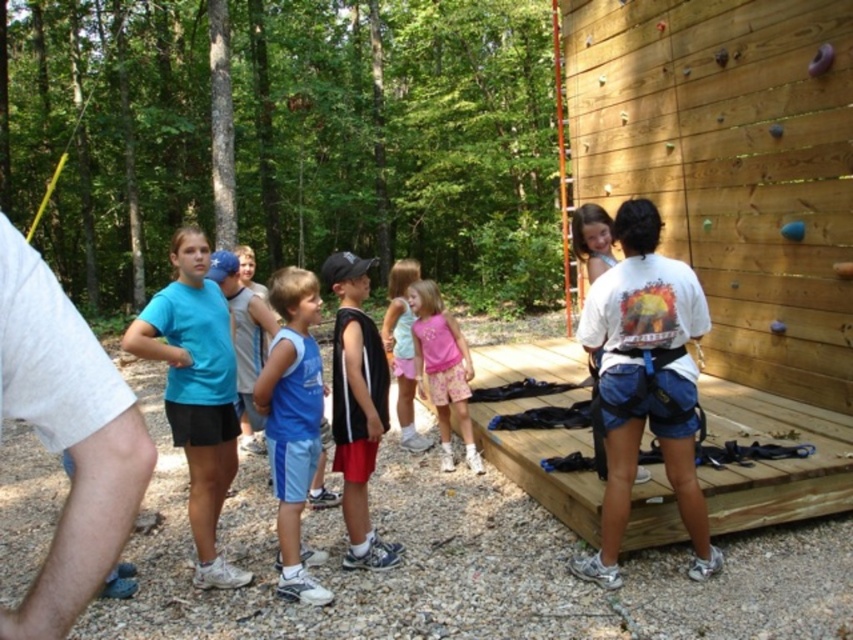
Question: Estimate the real-world distances between objects in this image. Which object is farther from the pink cotton shirt at center?

Choices:
 (A) matte blue t-shirt at center
 (B) blue fabric shorts at center
 (C) pink cotton dress at center
 (D) white cotton shirt at left

Answer: (D)

Question: Based on their relative distances, which object is nearer to the pink cotton dress at center?

Choices:
 (A) blue fabric shorts at center
 (B) pink cotton shirt at center

Answer: (B)

Question: Does matte blue t-shirt at center lie behind blue fabric shorts at center?

Choices:
 (A) no
 (B) yes

Answer: (A)

Question: From the image, what is the correct spatial relationship of white cotton shirt at left in relation to blue fabric shorts at center?

Choices:
 (A) below
 (B) above

Answer: (B)

Question: Where is white cotton shirt at left located in relation to pink cotton shirt at center in the image?

Choices:
 (A) above
 (B) below

Answer: (A)

Question: Among these points, which one is farthest from the camera?

Choices:
 (A) (405, 330)
 (B) (202, 458)
 (C) (428, 360)
 (D) (4, 253)

Answer: (A)